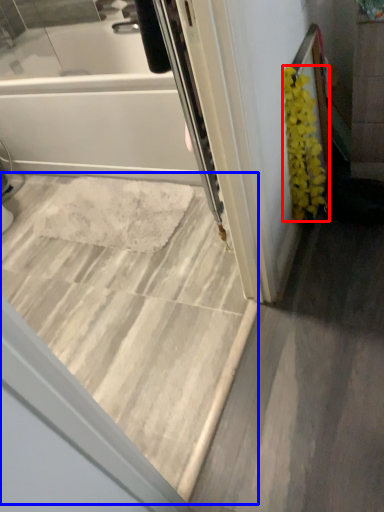
Question: Which object appears closest to the camera in this image, flower (highlighted by a red box) or stairwell (highlighted by a blue box)?

Choices:
 (A) flower
 (B) stairwell

Answer: (B)